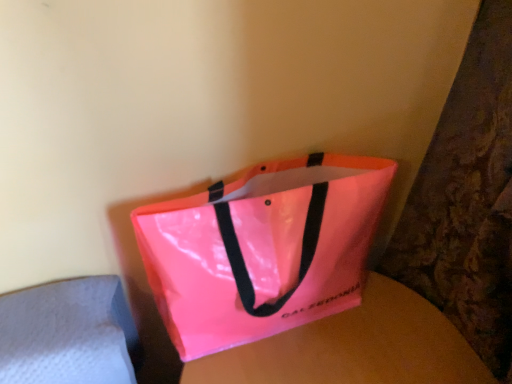
Question: Is neon pink glossy tote bag at center taller than pink glossy bag at center?

Choices:
 (A) no
 (B) yes

Answer: (A)

Question: Considering the relative positions of neon pink glossy tote bag at center and pink glossy bag at center in the image provided, is neon pink glossy tote bag at center in front of pink glossy bag at center?

Choices:
 (A) yes
 (B) no

Answer: (A)

Question: Is neon pink glossy tote bag at center facing away from pink glossy bag at center?

Choices:
 (A) yes
 (B) no

Answer: (B)

Question: Is neon pink glossy tote bag at center surrounding pink glossy bag at center?

Choices:
 (A) yes
 (B) no

Answer: (B)

Question: Is neon pink glossy tote bag at center located outside pink glossy bag at center?

Choices:
 (A) yes
 (B) no

Answer: (A)

Question: Are neon pink glossy tote bag at center and pink glossy bag at center beside each other?

Choices:
 (A) yes
 (B) no

Answer: (B)

Question: Does pink glossy bag at center have a greater height compared to neon pink glossy tote bag at center?

Choices:
 (A) no
 (B) yes

Answer: (B)

Question: Does pink glossy bag at center have a larger size compared to neon pink glossy tote bag at center?

Choices:
 (A) no
 (B) yes

Answer: (B)

Question: Could you tell me if pink glossy bag at center is turned towards neon pink glossy tote bag at center?

Choices:
 (A) no
 (B) yes

Answer: (A)

Question: From a real-world perspective, is pink glossy bag at center below neon pink glossy tote bag at center?

Choices:
 (A) no
 (B) yes

Answer: (B)

Question: Does pink glossy bag at center have a lesser width compared to neon pink glossy tote bag at center?

Choices:
 (A) no
 (B) yes

Answer: (A)

Question: From the image's perspective, is pink glossy bag at center below neon pink glossy tote bag at center?

Choices:
 (A) yes
 (B) no

Answer: (A)

Question: From the image's perspective, is pink glossy bag at center located above or below neon pink glossy tote bag at center?

Choices:
 (A) below
 (B) above

Answer: (A)